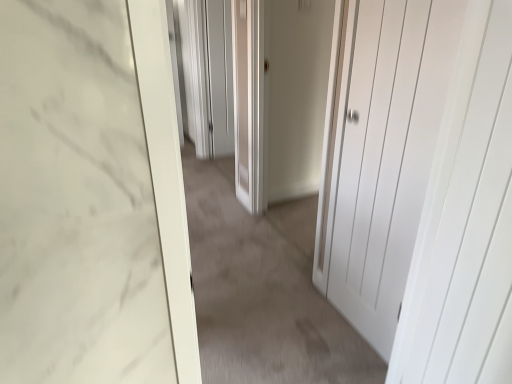
The width and height of the screenshot is (512, 384). What do you see at coordinates (384, 153) in the screenshot?
I see `white matte door at center, which is counted as the second door, starting from the left` at bounding box center [384, 153].

Locate an element on the screen. The width and height of the screenshot is (512, 384). white matte door at center, which appears as the first door when viewed from the left is located at coordinates (280, 97).

I want to click on white matte door at center, so click(263, 290).

What do you see at coordinates (220, 76) in the screenshot? This screenshot has width=512, height=384. I see `matte gray screen door at center` at bounding box center [220, 76].

Where is `white matte door at center, arranged as the 1th door when viewed from the right`? Image resolution: width=512 pixels, height=384 pixels. white matte door at center, arranged as the 1th door when viewed from the right is located at coordinates (384, 153).

Which is behind, point (233, 145) or point (368, 170)?

The point (233, 145) is more distant.

From the image's perspective, which is below, matte gray screen door at center or white matte door at center, which is counted as the second door, starting from the left?

white matte door at center, which is counted as the second door, starting from the left.

Considering the sizes of matte gray screen door at center and white matte door at center, arranged as the 1th door when viewed from the right, in the image, is matte gray screen door at center bigger or smaller than white matte door at center, arranged as the 1th door when viewed from the right,?

matte gray screen door at center is smaller than white matte door at center, arranged as the 1th door when viewed from the right.

Considering the relative positions of matte gray screen door at center and white matte door at center, which is counted as the second door, starting from the left, in the image provided, is matte gray screen door at center in front of white matte door at center, which is counted as the second door, starting from the left,?

No, it is not.

Does white matte door at center, which appears as the first door when viewed from the left, have a smaller size compared to white matte door at center, which is counted as the second door, starting from the left?

No.

In the scene shown: Does white matte door at center, the second door positioned from the right, have a greater height compared to white matte door at center, which is counted as the second door, starting from the left?

In fact, white matte door at center, the second door positioned from the right, may be shorter than white matte door at center, which is counted as the second door, starting from the left.

From the image's perspective, is white matte door at center, the second door positioned from the right, above or below white matte door at center, which is counted as the second door, starting from the left?

From the image's perspective, white matte door at center, the second door positioned from the right, appears above white matte door at center, which is counted as the second door, starting from the left.

Can you confirm if matte gray screen door at center is thinner than white matte door at center, which appears as the first door when viewed from the left?

Indeed, matte gray screen door at center has a lesser width compared to white matte door at center, which appears as the first door when viewed from the left.

From the image's perspective, is matte gray screen door at center above white matte door at center, which appears as the first door when viewed from the left?

Yes, from the image's perspective, matte gray screen door at center is on top of white matte door at center, which appears as the first door when viewed from the left.

Considering the sizes of objects matte gray screen door at center and white matte door at center, the second door positioned from the right, in the image provided, who is shorter, matte gray screen door at center or white matte door at center, the second door positioned from the right,?

Standing shorter between the two is matte gray screen door at center.

Is matte gray screen door at center facing away from white matte door at center, the second door positioned from the right?

No.

In order to click on the 1st door to the right of the matte gray screen door at center, starting your count from the anchor in this screenshot , I will do `click(280, 97)`.

Consider the image. From a real-world perspective, is white matte door at center, the second door positioned from the right, positioned above or below matte gray screen door at center?

In terms of real-world spatial position, white matte door at center, the second door positioned from the right, is above matte gray screen door at center.

Is point (294, 24) farther from camera compared to point (218, 16)?

No, (294, 24) is in front of (218, 16).

Is white matte door at center, the second door positioned from the right, oriented towards matte gray screen door at center?

No, white matte door at center, the second door positioned from the right, is not facing towards matte gray screen door at center.

Measure the distance between white matte door at center and white matte door at center, arranged as the 1th door when viewed from the right.

The distance of white matte door at center from white matte door at center, arranged as the 1th door when viewed from the right, is 25.96 inches.

From a real-world perspective, is white matte door at center above or below white matte door at center, which is counted as the second door, starting from the left?

white matte door at center is below white matte door at center, which is counted as the second door, starting from the left.

Looking at this image, does white matte door at center have a smaller size compared to white matte door at center, arranged as the 1th door when viewed from the right?

No, white matte door at center is not smaller than white matte door at center, arranged as the 1th door when viewed from the right.

Is there a large distance between white matte door at center and white matte door at center, arranged as the 1th door when viewed from the right?

No, there isn't a large distance between white matte door at center and white matte door at center, arranged as the 1th door when viewed from the right.

What's the angular difference between white matte door at center, which appears as the first door when viewed from the left, and white matte door at center's facing directions?

They differ by 89.5 degrees in their facing directions.

From the image's perspective, which one is positioned lower, white matte door at center, the second door positioned from the right, or white matte door at center?

white matte door at center, from the image's perspective.

Does white matte door at center, which appears as the first door when viewed from the left, have a larger size compared to white matte door at center?

Indeed, white matte door at center, which appears as the first door when viewed from the left, has a larger size compared to white matte door at center.

This screenshot has width=512, height=384. Find the location of `door that is the 1st object above the white matte door at center (from a real-world perspective)`. door that is the 1st object above the white matte door at center (from a real-world perspective) is located at coordinates (280, 97).

Which object is wider, white matte door at center or matte gray screen door at center?

white matte door at center.

Can you confirm if white matte door at center is smaller than matte gray screen door at center?

No.

Does white matte door at center lie in front of matte gray screen door at center?

Yes, white matte door at center is closer to the camera.

Locate an element on the screen. The image size is (512, 384). the 2nd door below the matte gray screen door at center (from the image's perspective) is located at coordinates (384, 153).

Image resolution: width=512 pixels, height=384 pixels. Find the location of `door located above the white matte door at center, which is counted as the second door, starting from the left (from the image's perspective)`. door located above the white matte door at center, which is counted as the second door, starting from the left (from the image's perspective) is located at coordinates (280, 97).

Estimate the real-world distances between objects in this image. Which object is further from white matte door at center, which appears as the first door when viewed from the left, white matte door at center or white matte door at center, arranged as the 1th door when viewed from the right?

white matte door at center, arranged as the 1th door when viewed from the right, is positioned further to the anchor white matte door at center, which appears as the first door when viewed from the left.

Based on their spatial positions, is white matte door at center, arranged as the 1th door when viewed from the right, or white matte door at center, which appears as the first door when viewed from the left, further from white matte door at center?

The object further to white matte door at center is white matte door at center, which appears as the first door when viewed from the left.

Estimate the real-world distances between objects in this image. Which object is further from white matte door at center, white matte door at center, the second door positioned from the right, or white matte door at center, arranged as the 1th door when viewed from the right?

white matte door at center, the second door positioned from the right, is further to white matte door at center.

When comparing their distances from white matte door at center, which appears as the first door when viewed from the left, does white matte door at center or matte gray screen door at center seem further?

The object further to white matte door at center, which appears as the first door when viewed from the left, is matte gray screen door at center.

Which object lies nearer to the anchor point white matte door at center, arranged as the 1th door when viewed from the right, matte gray screen door at center or white matte door at center?

white matte door at center is closer to white matte door at center, arranged as the 1th door when viewed from the right.

Which object lies further to the anchor point white matte door at center, which is counted as the second door, starting from the left, white matte door at center, the second door positioned from the right, or white matte door at center?

Based on the image, white matte door at center, the second door positioned from the right, appears to be further to white matte door at center, which is counted as the second door, starting from the left.

Looking at the image, which one is located further to matte gray screen door at center, white matte door at center or white matte door at center, arranged as the 1th door when viewed from the right?

white matte door at center, arranged as the 1th door when viewed from the right, is positioned further to the anchor matte gray screen door at center.

Which object lies nearer to the anchor point white matte door at center, which appears as the first door when viewed from the left, white matte door at center, which is counted as the second door, starting from the left, or white matte door at center?

white matte door at center.

This screenshot has width=512, height=384. I want to click on door between white matte door at center and white matte door at center, which is counted as the second door, starting from the left, so click(x=280, y=97).

Where is `plain between white matte door at center, which is counted as the second door, starting from the left, and matte gray screen door at center from front to back`? plain between white matte door at center, which is counted as the second door, starting from the left, and matte gray screen door at center from front to back is located at coordinates (263, 290).

Identify the location of door between white matte door at center and matte gray screen door at center from front to back. The image size is (512, 384). (280, 97).

This screenshot has width=512, height=384. What are the coordinates of `door between white matte door at center, which is counted as the second door, starting from the left, and matte gray screen door at center in the front-back direction` in the screenshot? It's located at (280, 97).